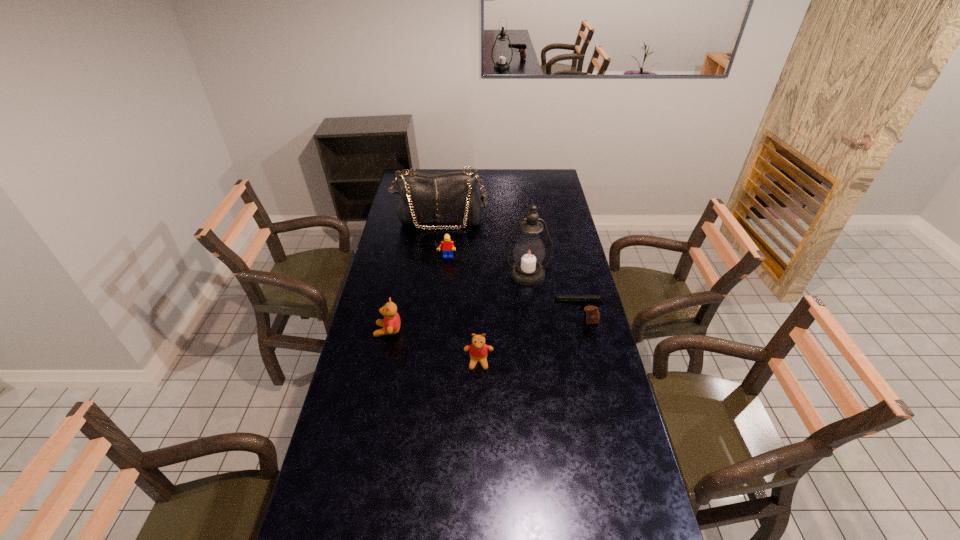
Identify the location of vacant space situated on the front-facing side of the right teddy bear. (478, 471).

Image resolution: width=960 pixels, height=540 pixels. Find the location of `free space located on the front-facing side of the Lego`. free space located on the front-facing side of the Lego is located at coordinates (445, 270).

At what (x,y) coordinates should I click in order to perform the action: click on vacant space located 0.140m at the front of the handbag with chain and zipper. Please return your answer as a coordinate pair (x, y). This screenshot has width=960, height=540. Looking at the image, I should click on (437, 250).

The image size is (960, 540). I want to click on vacant space located 0.360m on the back of the tallest object, so click(520, 218).

I want to click on free location located at the barrel of the pistol, so click(520, 322).

This screenshot has width=960, height=540. I want to click on vacant area located 0.260m at the barrel of the pistol, so click(x=484, y=322).

Identify the location of vacant space located at the barrel of the pistol. [x=474, y=322].

Where is `teddy bear that is at the left edge`? teddy bear that is at the left edge is located at coordinates (391, 323).

This screenshot has height=540, width=960. In order to click on handbag present at the left edge in this screenshot , I will do `click(450, 197)`.

This screenshot has height=540, width=960. Find the location of `oil lamp positioned at the right edge`. oil lamp positioned at the right edge is located at coordinates (529, 251).